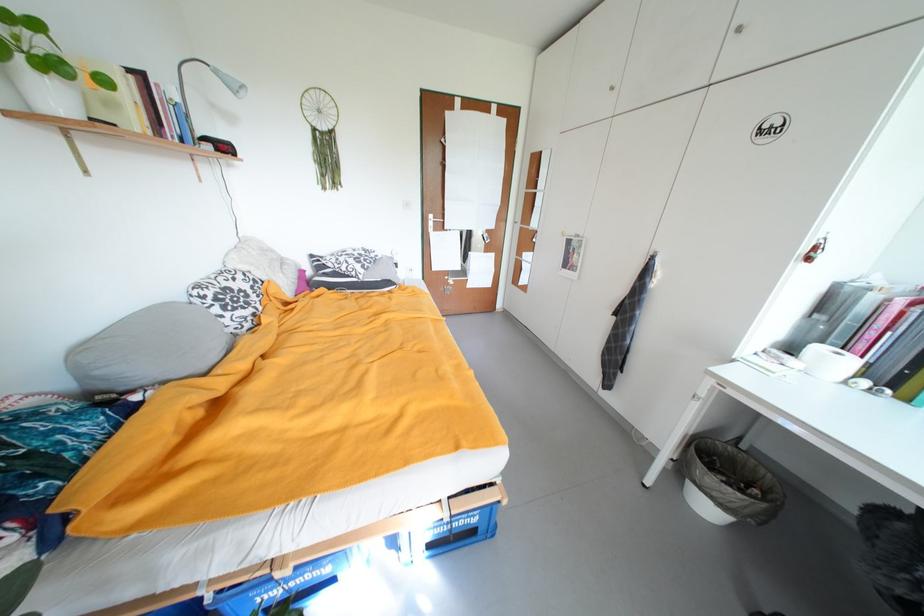
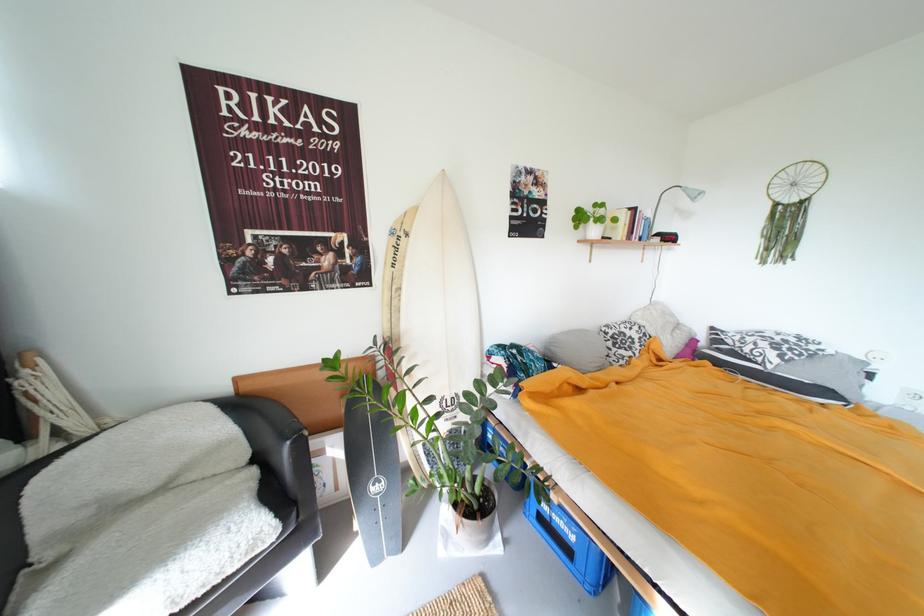
Locate, in the second image, the point that corresponds to pixel 234 150 in the first image.

(677, 240)